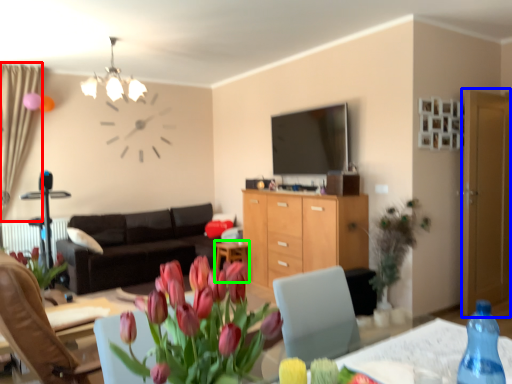
Question: Which is farther away from curtain (highlighted by a red box)? glass door (highlighted by a blue box) or desk (highlighted by a green box)?

Choices:
 (A) glass door
 (B) desk

Answer: (A)